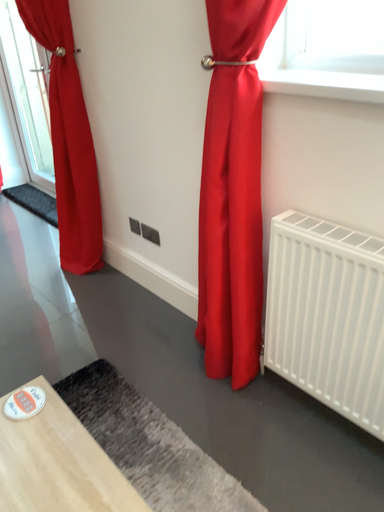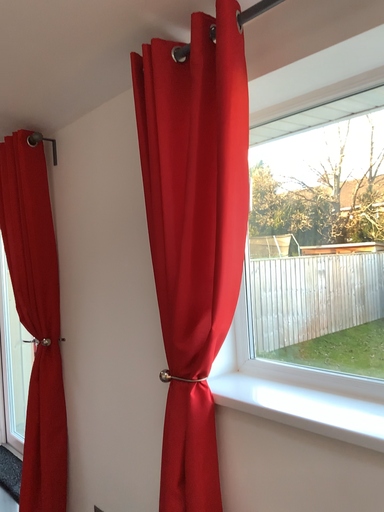
Question: How did the camera likely rotate when shooting the video?

Choices:
 (A) rotated upward
 (B) rotated downward

Answer: (A)